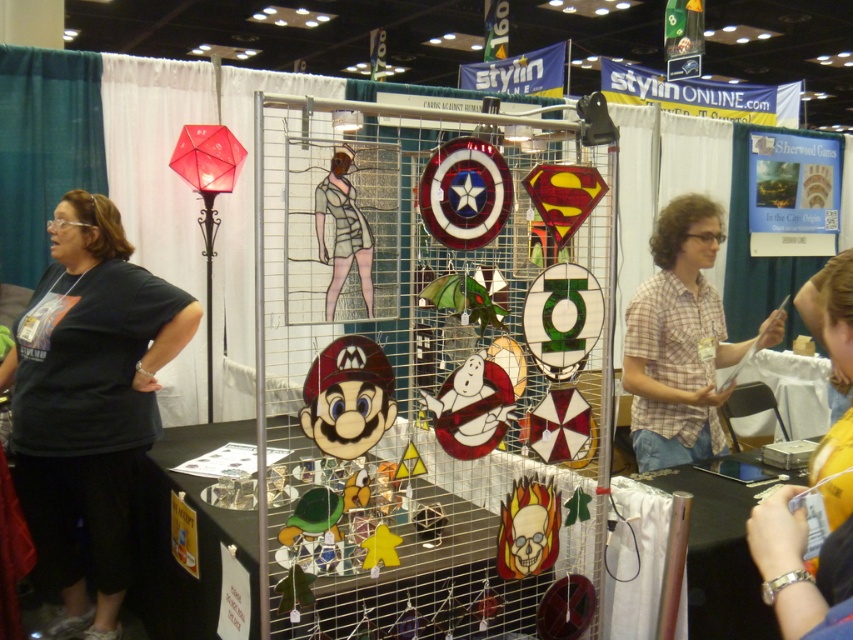
Question: Does black fabric shirt at left have a greater width compared to plaid shirt at center?

Choices:
 (A) no
 (B) yes

Answer: (B)

Question: Which object is farther from the camera taking this photo?

Choices:
 (A) plaid shirt at center
 (B) black fabric shirt at left

Answer: (A)

Question: Which point appears closest to the camera in this image?

Choices:
 (A) (776, 324)
 (B) (117, 246)

Answer: (A)

Question: Is black fabric shirt at left positioned in front of plaid shirt at center?

Choices:
 (A) no
 (B) yes

Answer: (B)

Question: Is the position of black fabric shirt at left less distant than that of plaid shirt at center?

Choices:
 (A) yes
 (B) no

Answer: (A)

Question: Which object appears farthest from the camera in this image?

Choices:
 (A) plaid shirt at center
 (B) black fabric shirt at left

Answer: (A)